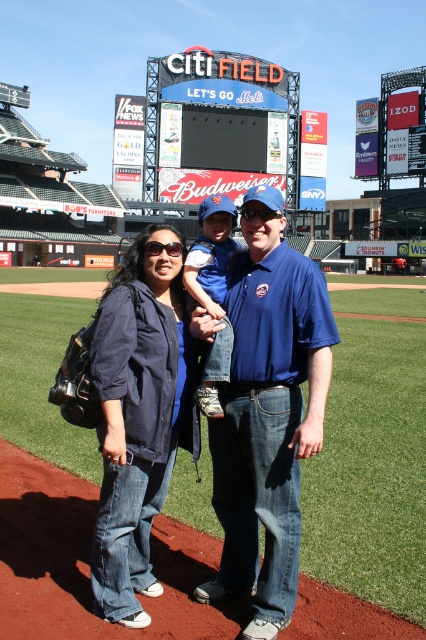
You are a photographer trying to capture a photo of the denim jacket at lower left and the neon sign at upper center in the scene. Which object is closer to the ground?

The denim jacket at lower left is shorter than the neon sign at upper center, so it is closer to the ground.

You are a photographer at Citi Field and want to capture a photo of the blue cotton shirt at center and the neon sign at upper center in the same frame. Based on their positions, which object is closer to the left side of the photo?

The blue cotton shirt at center is to the left of the neon sign at upper center, so it would appear closer to the left side of the photo.